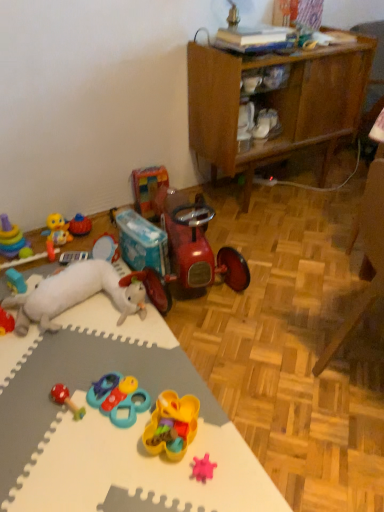
Identify the location of free space in front of rubber duck at left, the 4th toy from the left. This screenshot has width=384, height=512. (54, 258).